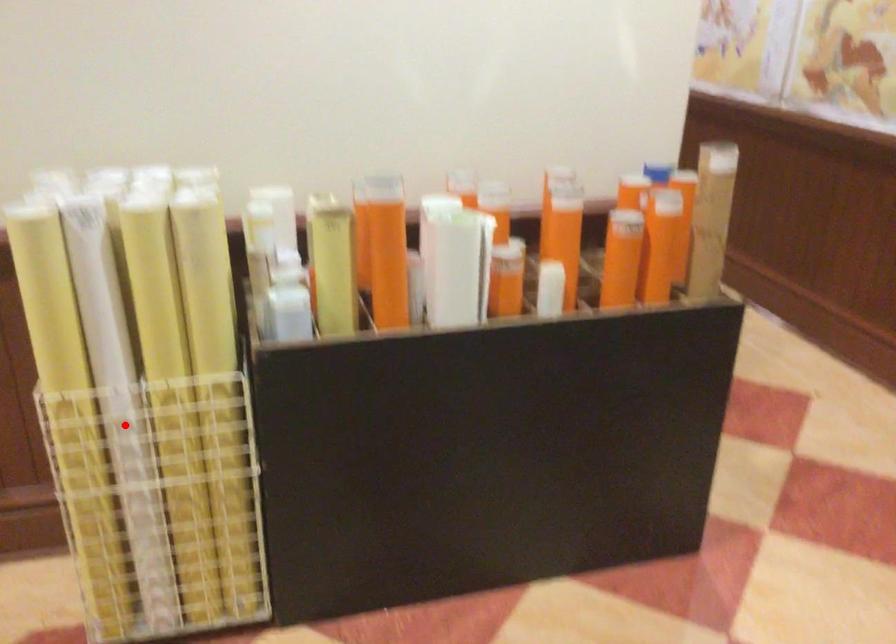
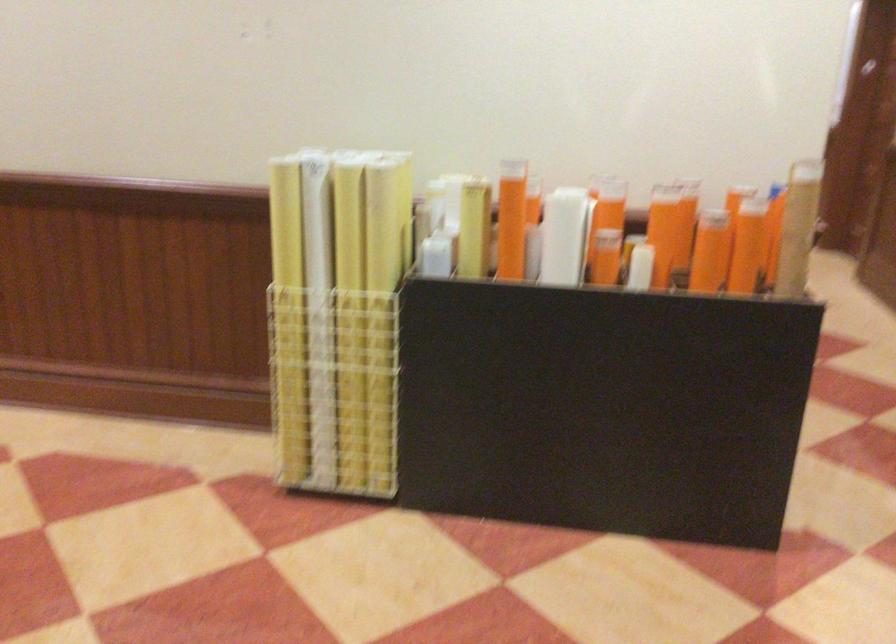
Find the pixel in the second image that matches the highlighted location in the first image.

(319, 319)